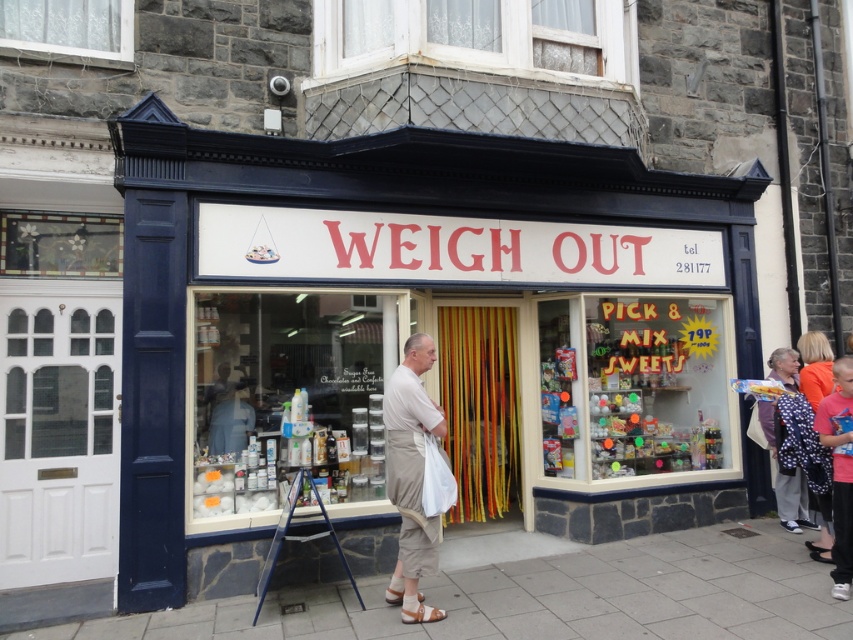
Which is behind, point (846, 442) or point (410, 612)?

The point (846, 442) is behind.

Between pink fabric at lower right and tan leather sandal at lower center, which one has less height?

tan leather sandal at lower center

Which is in front, point (839, 596) or point (416, 612)?

Point (416, 612)

Find the location of `pink fabric at lower right`. pink fabric at lower right is located at coordinates (839, 470).

Can you confirm if gray concrete pavement at lower center is thinner than tan leather sandal at lower center?

In fact, gray concrete pavement at lower center might be wider than tan leather sandal at lower center.

Find the location of a particular element. gray concrete pavement at lower center is located at coordinates (544, 595).

Is point (572, 616) behind point (405, 609)?

That is True.

Locate an element on the screen. This screenshot has width=853, height=640. gray concrete pavement at lower center is located at coordinates (544, 595).

Does gray concrete pavement at lower center have a smaller size compared to beige cotton apron at center?

Actually, gray concrete pavement at lower center might be larger than beige cotton apron at center.

Locate an element on the screen. The width and height of the screenshot is (853, 640). gray concrete pavement at lower center is located at coordinates (544, 595).

Is point (701, 579) more distant than point (389, 493)?

Yes, point (701, 579) is behind point (389, 493).

The height and width of the screenshot is (640, 853). In order to click on gray concrete pavement at lower center in this screenshot , I will do pos(544,595).